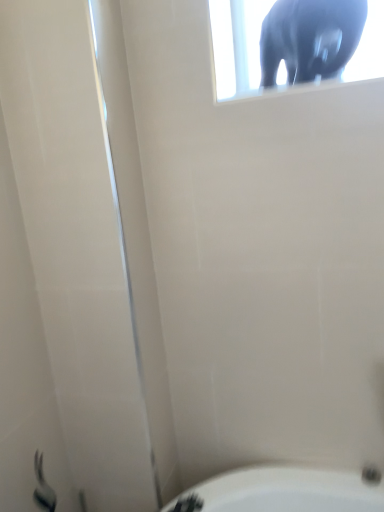
You are a GUI agent. You are given a task and a screenshot of the screen. Output one action in this format:
    pyautogui.click(x=<x>, y=<y>)
    Task: Click on the matte gray elephant at upper center
    
    Given the screenshot: What is the action you would take?
    pyautogui.click(x=310, y=38)

Looking at this image, in order to face matte gray elephant at upper center, should I rotate leftwards or rightwards?

Rotate right and turn 16.056 degrees.

This screenshot has width=384, height=512. What do you see at coordinates (310, 38) in the screenshot?
I see `matte gray elephant at upper center` at bounding box center [310, 38].

Where is `matte gray elephant at upper center`? This screenshot has height=512, width=384. matte gray elephant at upper center is located at coordinates tap(310, 38).